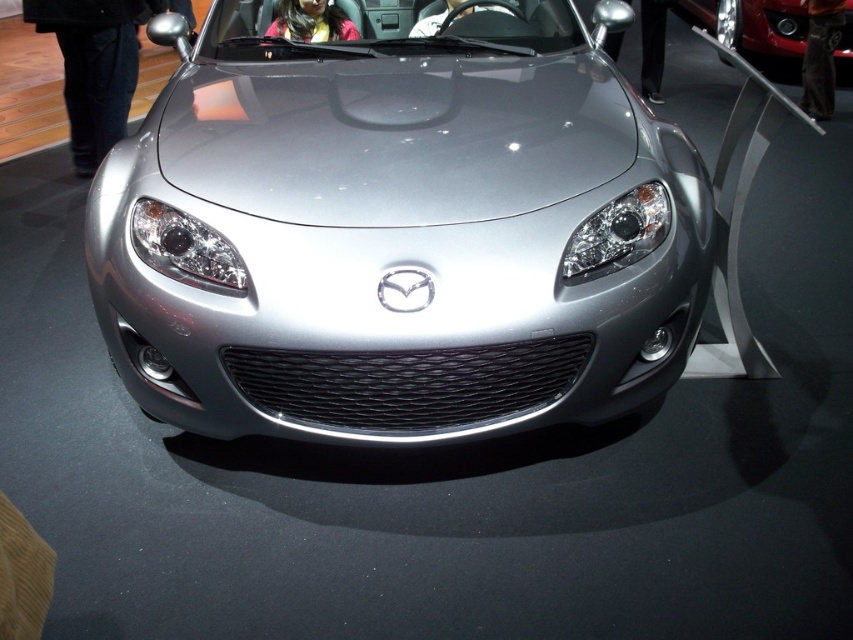
You are a photographer standing at the center of an auto show hall. You want to take a photo of the metallic silver car at center. According to the coordinates given by point (753, 26), where should you aim your camera to capture the car in the best possible way?

The metallic silver car at center is represented by point (753, 26), so you should aim your camera at that coordinate to capture the car in the best possible way.

You are a photographer at an auto show and want to capture the satin silver car at center without the metallic silver car at center blocking it. Can you move to the left side to take the photo?

The satin silver car at center is behind the metallic silver car at center, so moving to the left side may not allow you to see the satin silver car at center clearly as it is obstructed by the metallic silver car at center.

You are a photographer at an auto show and want to capture both the metallic silver car at center and the satin silver car at center in a single frame. Given that your camera can only focus on objects within a 10m distance, will both cars fit within the camera focus range if they are placed 8 meters apart from each other?

The metallic silver car at center is larger in size than the satin silver car at center, but since both are positioned 8 meters away from each other and the camera can focus up to 10 meters, both cars will fit within the focus range as long as they are within the 10m limit from the camera. However, the description does not specify their distance from the camera, only their separation from each other.